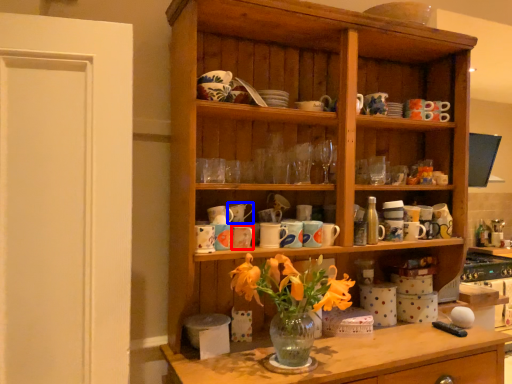
Question: Which object appears closest to the camera in this image, tableware (highlighted by a red box) or tableware (highlighted by a blue box)?

Choices:
 (A) tableware
 (B) tableware

Answer: (A)